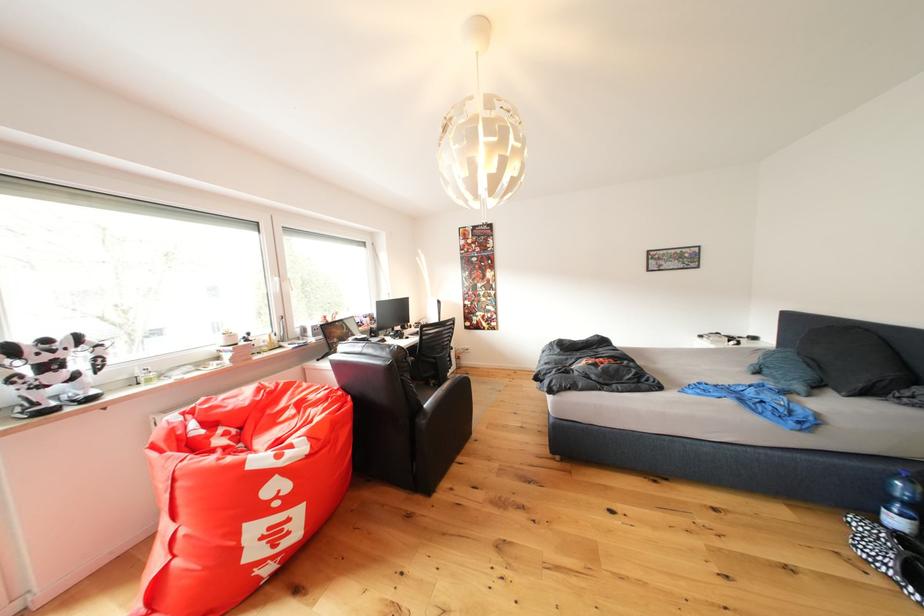
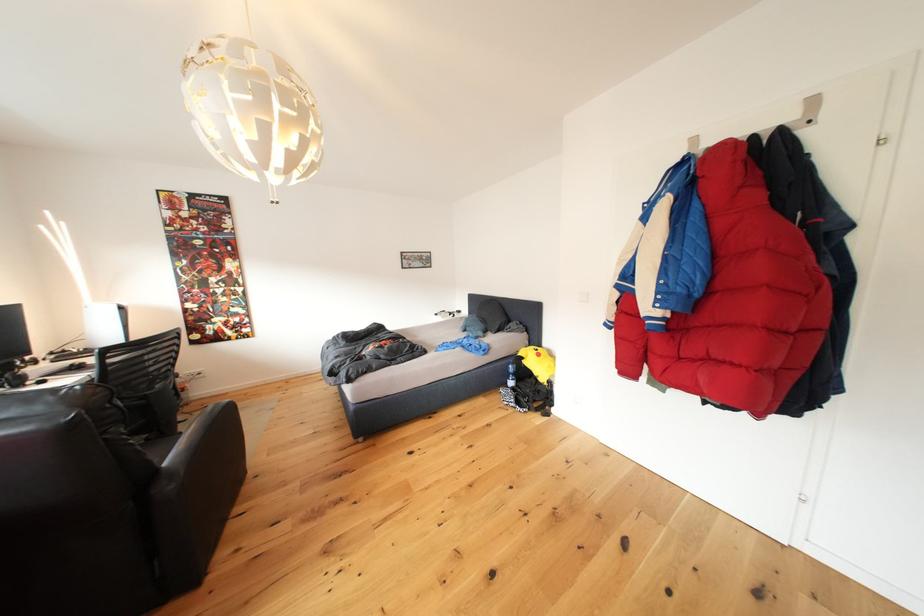
Question: The camera is either moving clockwise (left) or counter-clockwise (right) around the object. The first image is from the beginning of the video and the second image is from the end. Is the camera moving left or right when shooting the video?

Choices:
 (A) Left
 (B) Right

Answer: (A)